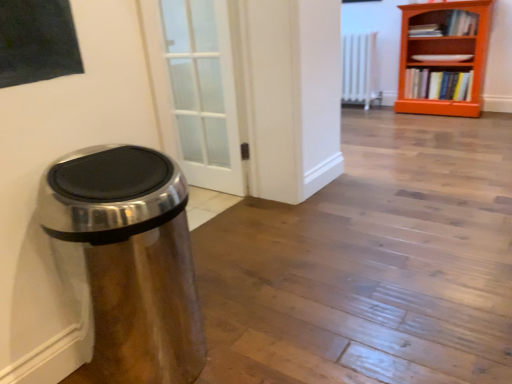
Question: Is white metallic radiator at center far away from satin metallic trash can at left?

Choices:
 (A) yes
 (B) no

Answer: (A)

Question: Could you tell me if white metallic radiator at center is turned towards satin metallic trash can at left?

Choices:
 (A) no
 (B) yes

Answer: (B)

Question: Is white metallic radiator at center to the right of satin metallic trash can at left from the viewer's perspective?

Choices:
 (A) yes
 (B) no

Answer: (A)

Question: Can you confirm if white metallic radiator at center is wider than satin metallic trash can at left?

Choices:
 (A) no
 (B) yes

Answer: (A)

Question: Does white metallic radiator at center lie behind satin metallic trash can at left?

Choices:
 (A) yes
 (B) no

Answer: (A)

Question: From the image's perspective, does white metallic radiator at center appear lower than satin metallic trash can at left?

Choices:
 (A) no
 (B) yes

Answer: (A)

Question: Is orange wooden bookcase at upper right directly adjacent to white metallic radiator at center?

Choices:
 (A) no
 (B) yes

Answer: (A)

Question: Considering the relative positions of orange wooden bookcase at upper right and white metallic radiator at center in the image provided, is orange wooden bookcase at upper right to the right of white metallic radiator at center from the viewer's perspective?

Choices:
 (A) no
 (B) yes

Answer: (B)

Question: Could you tell me if orange wooden bookcase at upper right is turned towards white metallic radiator at center?

Choices:
 (A) yes
 (B) no

Answer: (B)

Question: From the image's perspective, does orange wooden bookcase at upper right appear higher than white metallic radiator at center?

Choices:
 (A) no
 (B) yes

Answer: (A)

Question: From a real-world perspective, is orange wooden bookcase at upper right over white metallic radiator at center?

Choices:
 (A) no
 (B) yes

Answer: (B)

Question: From a real-world perspective, is orange wooden bookcase at upper right located beneath white metallic radiator at center?

Choices:
 (A) no
 (B) yes

Answer: (A)

Question: From the image's perspective, is hardcover book at right, which appears as the 1th book when ordered from the bottom, under orange wooden bookcase at upper right?

Choices:
 (A) yes
 (B) no

Answer: (A)